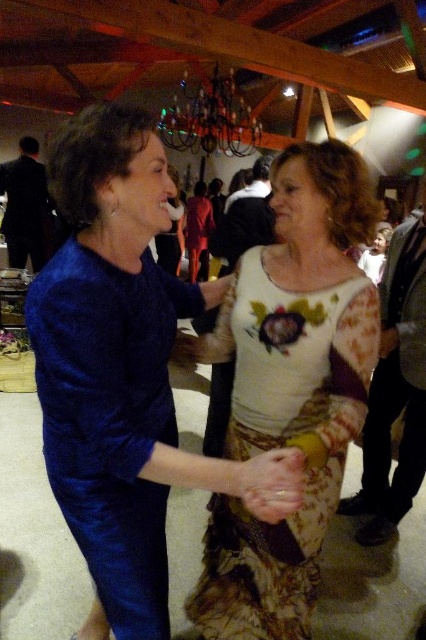
Which is above, floral-patterned fabric dress at center or metallic chandelier at upper center?

Positioned higher is metallic chandelier at upper center.

From the picture: Does floral-patterned fabric dress at center lie in front of metallic chandelier at upper center?

Yes, it is.

The image size is (426, 640). What do you see at coordinates (282, 444) in the screenshot?
I see `floral-patterned fabric dress at center` at bounding box center [282, 444].

Where is `floral-patterned fabric dress at center`? The width and height of the screenshot is (426, 640). floral-patterned fabric dress at center is located at coordinates (282, 444).

Does matte blue dress at center appear on the right side of metallic chandelier at upper center?

Incorrect, matte blue dress at center is not on the right side of metallic chandelier at upper center.

Is point (108, 636) positioned in front of point (186, 140)?

Yes, point (108, 636) is in front of point (186, 140).

Find the location of `matte blue dress at center`. matte blue dress at center is located at coordinates (123, 372).

Can you confirm if matte blue dress at center is positioned to the left of floral-patterned fabric dress at center?

Indeed, matte blue dress at center is positioned on the left side of floral-patterned fabric dress at center.

Can you confirm if matte blue dress at center is smaller than floral-patterned fabric dress at center?

Incorrect, matte blue dress at center is not smaller in size than floral-patterned fabric dress at center.

What do you see at coordinates (123, 372) in the screenshot? Image resolution: width=426 pixels, height=640 pixels. I see `matte blue dress at center` at bounding box center [123, 372].

I want to click on matte blue dress at center, so click(x=123, y=372).